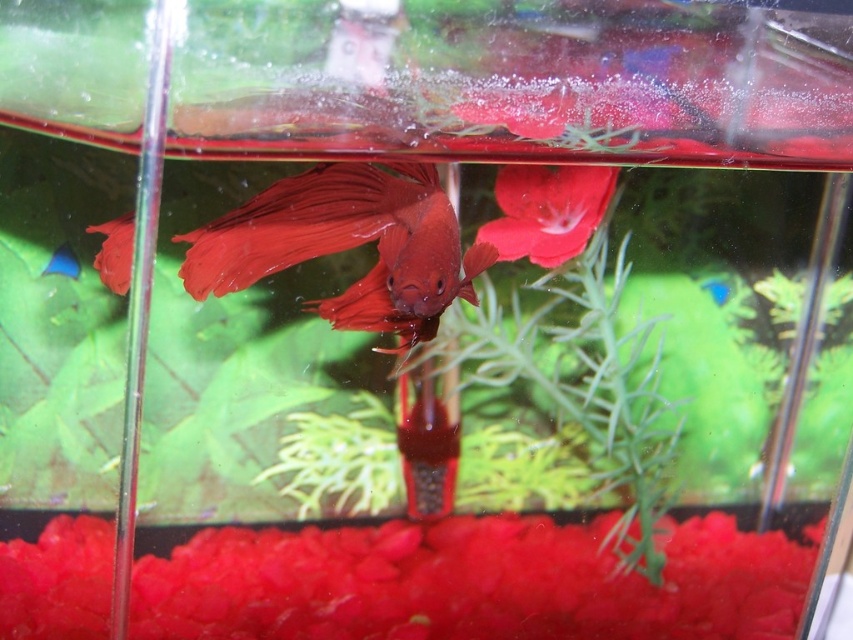
Question: Is shiny red fish at center smaller than matte red fish at center?

Choices:
 (A) yes
 (B) no

Answer: (B)

Question: Is the position of shiny red fish at center less distant than that of matte red fish at center?

Choices:
 (A) yes
 (B) no

Answer: (A)

Question: Is the position of shiny red fish at center more distant than that of matte red fish at center?

Choices:
 (A) yes
 (B) no

Answer: (B)

Question: Which point appears farthest from the camera in this image?

Choices:
 (A) (251, 268)
 (B) (71, 257)

Answer: (B)